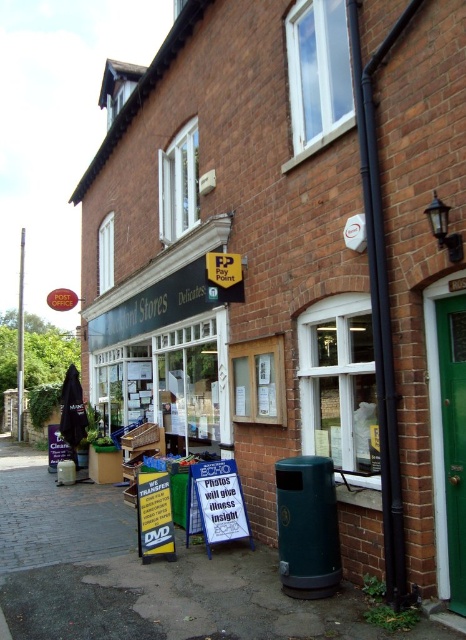
Based on the photo, you are standing in front of the Huckford Stores Delicates storefront. You need to locate the black plastic pipe at upper right. Where exactly is it positioned in terms of coordinates?

The black plastic pipe at upper right is positioned at coordinates 0.473 on the x axis and 0.818 on the y axis.

You are a delivery person trying to secure a package to the storefront using straps. The black plastic pipe at upper right and the green metallic pole at left are both available for tying. Which object would you choose if you need a thicker surface to attach the straps?

The green metallic pole at left is thicker than the black plastic pipe at upper right, so you should choose the green metallic pole at left to attach the straps for better stability.